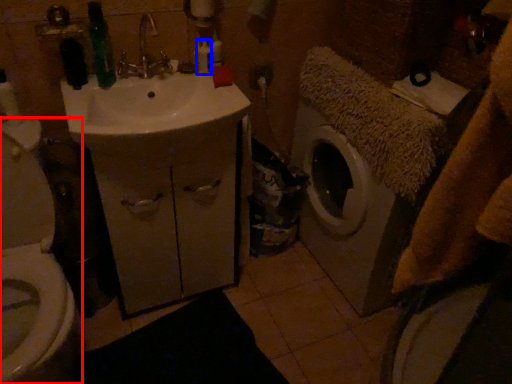
Question: Among these objects, which one is nearest to the camera, toilet (highlighted by a red box) or toiletry (highlighted by a blue box)?

Choices:
 (A) toilet
 (B) toiletry

Answer: (A)